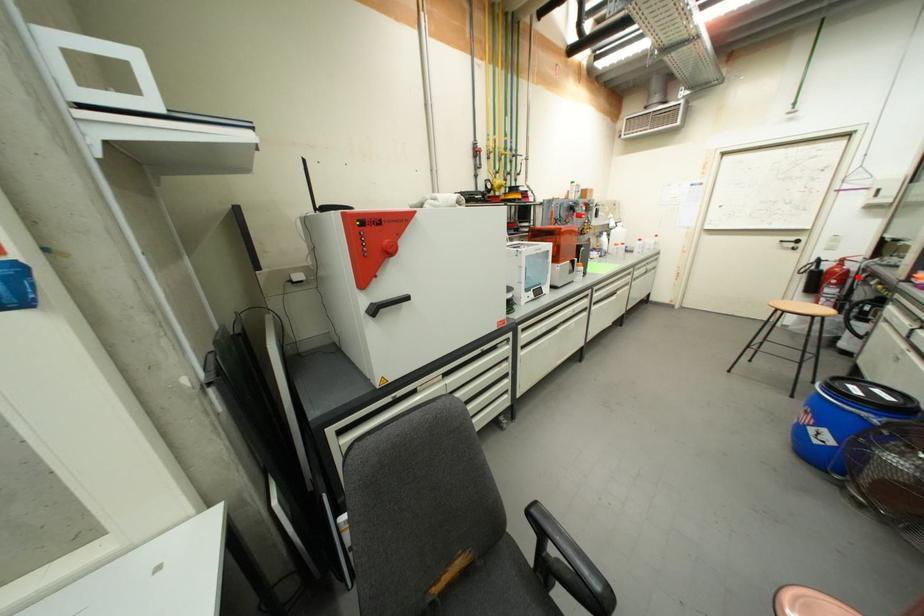
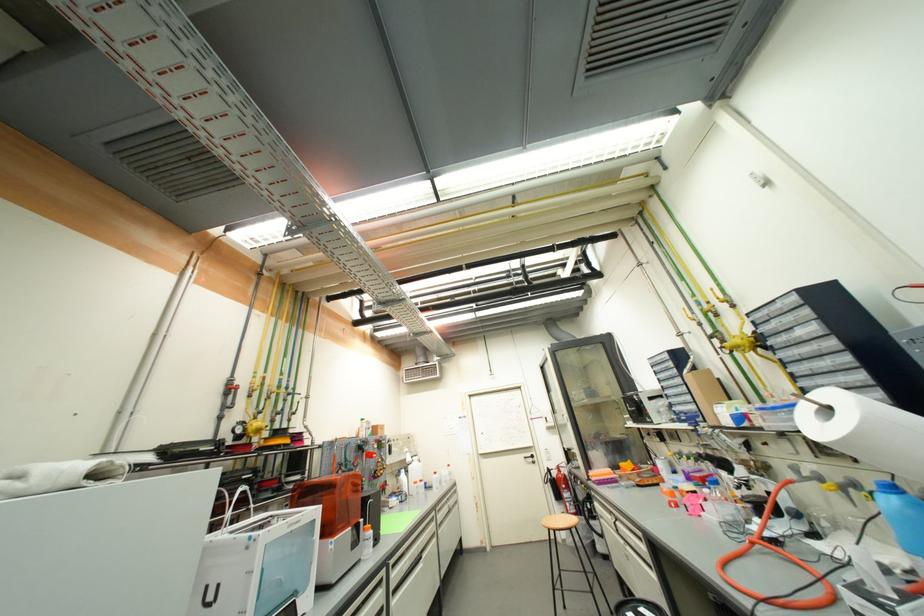
Find the pixel in the second image that matches the highlighted location in the first image.

(574, 480)